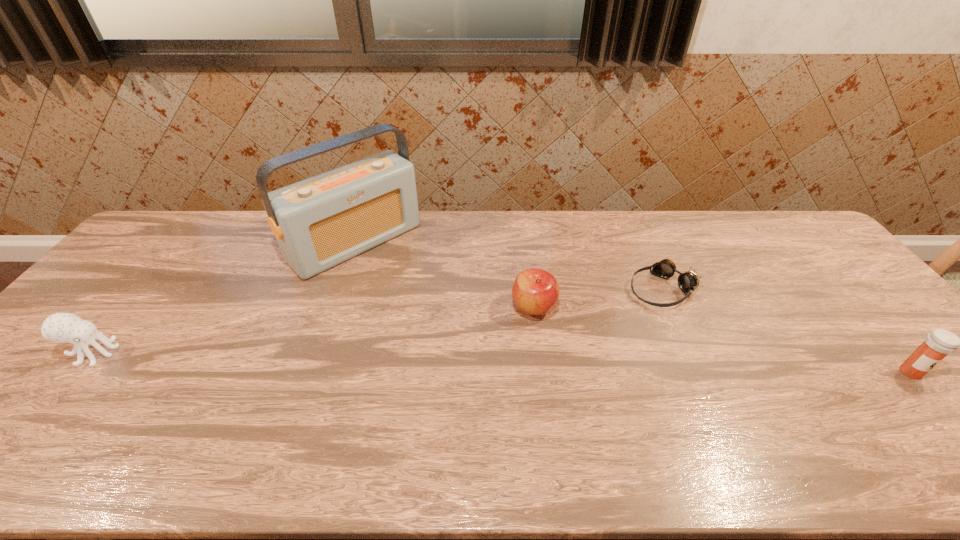
Identify the location of blank region between the rightmost object and the octopus. (502, 362).

Where is `empty space between the shortest object and the medicine`? The height and width of the screenshot is (540, 960). empty space between the shortest object and the medicine is located at coordinates (787, 330).

Identify the location of empty space that is in between the fourth object from left to right and the rightmost object. This screenshot has height=540, width=960. (787, 330).

Where is `empty location between the apple and the radio receiver`? The height and width of the screenshot is (540, 960). empty location between the apple and the radio receiver is located at coordinates (444, 275).

In order to click on free space that is in between the medicine and the second object from right to left in this screenshot , I will do `click(787, 330)`.

Select which object appears as the second closest to the rightmost object. Please provide its 2D coordinates. Your answer should be formatted as a tuple, i.e. [(x, y)], where the tuple contains the x and y coordinates of a point satisfying the conditions above.

[(535, 291)]

Locate an element on the screen. The width and height of the screenshot is (960, 540). the second closest object to the rightmost object is located at coordinates (535, 291).

You are a GUI agent. You are given a task and a screenshot of the screen. Output one action in this format:
    pyautogui.click(x=<x>, y=<y>)
    Task: Click on the free location that satisfies the following two spatial constraints: 1. on the front side of the shortest object; 2. on the right side of the tallest object
    The image size is (960, 540).
    Given the screenshot: What is the action you would take?
    click(340, 289)